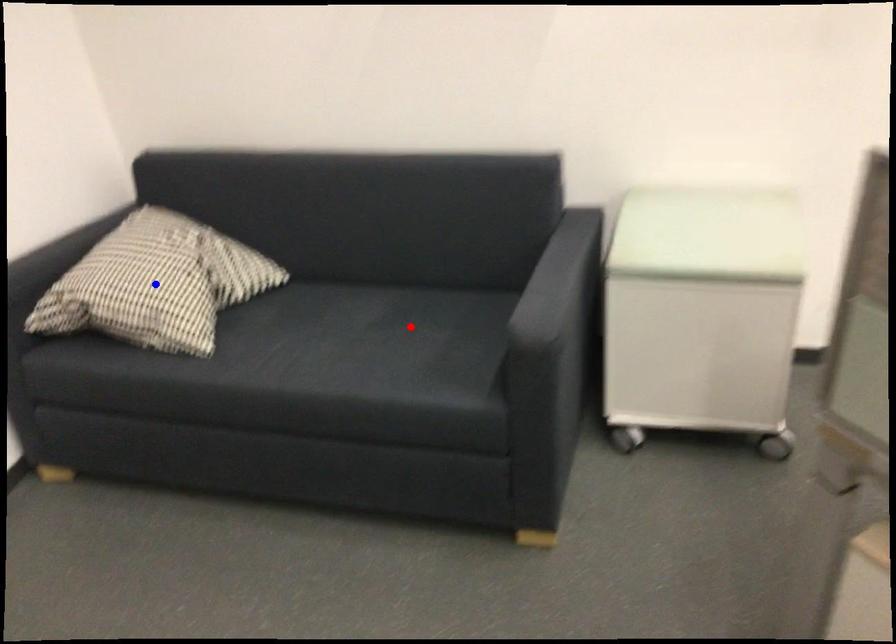
Question: In the image, two points are highlighted. Which point is nearer to the camera? Reply with the corresponding letter.

Choices:
 (A) blue point
 (B) red point

Answer: (B)